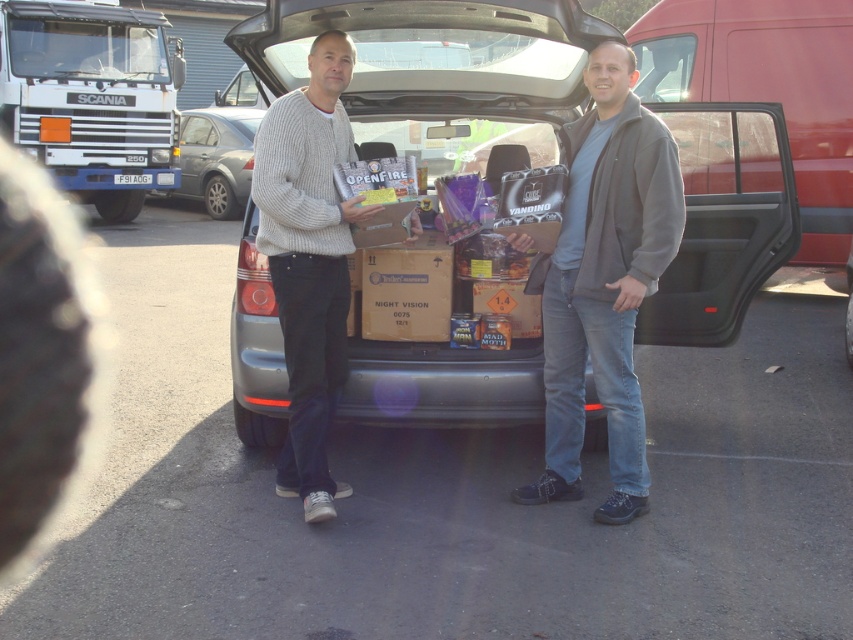
Question: Which of the following is the farthest from the observer?

Choices:
 (A) metallic gray car at center
 (B) gray fleece jacket at center

Answer: (A)

Question: Among these objects, which one is nearest to the camera?

Choices:
 (A) metallic silver sedan at center
 (B) brown cardboard box at center
 (C) gray fleece jacket at center

Answer: (C)

Question: Where is metallic gray car at center located in relation to white matte truck at upper left in the image?

Choices:
 (A) left
 (B) right

Answer: (B)

Question: Which point appears closest to the camera in this image?

Choices:
 (A) tap(134, 140)
 (B) tap(316, 417)
 (C) tap(213, 156)

Answer: (B)

Question: Where is gray fleece jacket at center located in relation to knitted sweater at center in the image?

Choices:
 (A) right
 (B) left

Answer: (A)

Question: Is gray fleece jacket at center further to the viewer compared to brown cardboard box at center?

Choices:
 (A) no
 (B) yes

Answer: (A)